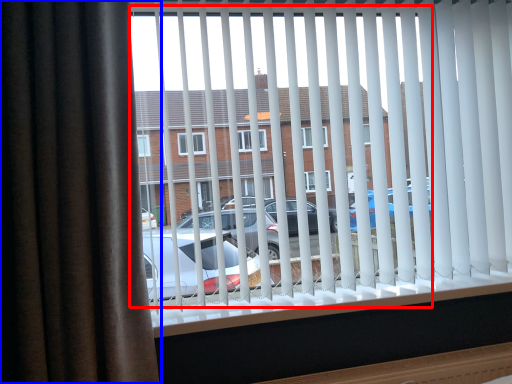
Question: Among these objects, which one is nearest to the camera, bay window (highlighted by a red box) or curtain (highlighted by a blue box)?

Choices:
 (A) bay window
 (B) curtain

Answer: (B)